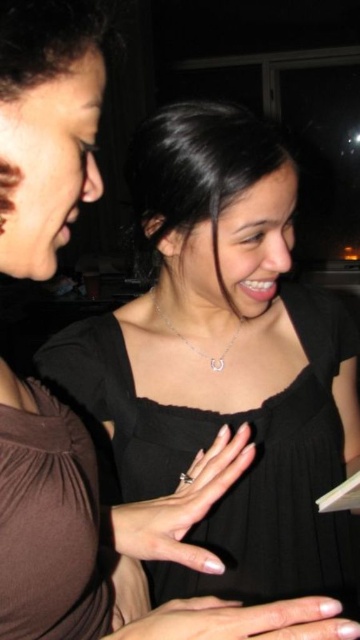
Question: Which point appears closest to the camera in this image?

Choices:
 (A) (262, 624)
 (B) (297, 486)
 (C) (6, 589)

Answer: (C)

Question: Which of the following is the closest to the observer?

Choices:
 (A) [x=217, y=497]
 (B) [x=234, y=332]
 (C) [x=313, y=429]

Answer: (A)

Question: Is black satin dress at center positioned in front of brown matte dress at lower left?

Choices:
 (A) no
 (B) yes

Answer: (A)

Question: Estimate the real-world distances between objects in this image. Which object is closer to the silver metallic ring at center?

Choices:
 (A) nail polish at center
 (B) brown matte dress at lower left
 (C) silver metallic necklace at center

Answer: (A)

Question: Does black satin dress at center have a lesser width compared to silver metallic necklace at center?

Choices:
 (A) no
 (B) yes

Answer: (A)

Question: Is black satin dress at center smaller than brown matte dress at lower left?

Choices:
 (A) no
 (B) yes

Answer: (A)